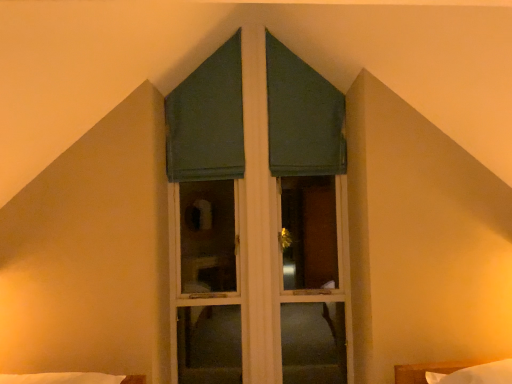
Question: Considering the positions of point (421, 369) and point (233, 119), is point (421, 369) closer or farther from the camera than point (233, 119)?

Choices:
 (A) farther
 (B) closer

Answer: (B)

Question: From a real-world perspective, is white soft bed at lower right above or below green fabric curtain at center, positioned as the 2th curtain in right-to-left order?

Choices:
 (A) below
 (B) above

Answer: (A)

Question: Which of these objects is positioned closest to the green fabric curtain at center, marked as the first curtain in a left-to-right arrangement?

Choices:
 (A) green matte window at center
 (B) white soft bed at lower right
 (C) green fabric curtain at upper center, marked as the second curtain in a left-to-right arrangement

Answer: (A)

Question: Estimate the real-world distances between objects in this image. Which object is farther from the white soft bed at lower right?

Choices:
 (A) green matte window at center
 (B) green fabric curtain at center, positioned as the 2th curtain in right-to-left order
 (C) green fabric curtain at upper center, marked as the second curtain in a left-to-right arrangement

Answer: (B)